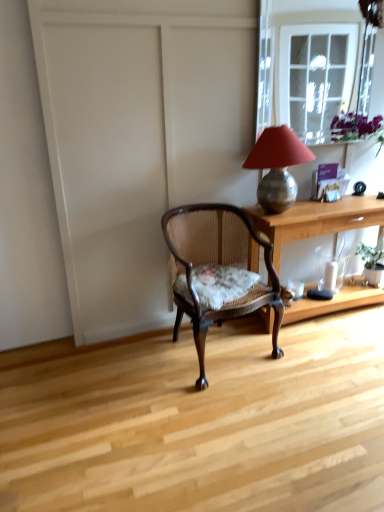
Locate an element on the screen. The image size is (384, 512). vacant area that is in front of wooden cane chair with floral cushion at center is located at coordinates click(x=221, y=413).